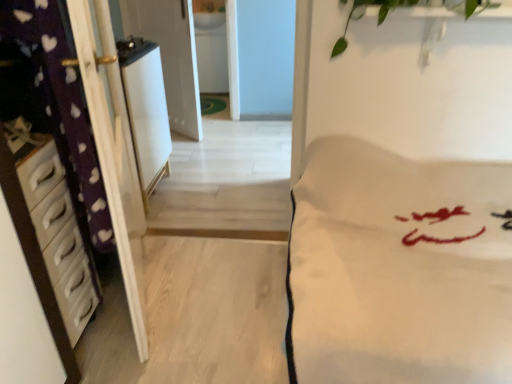
What are the coordinates of `vacant area that lies to the right of white glossy refrigerator at center` in the screenshot? It's located at (210, 202).